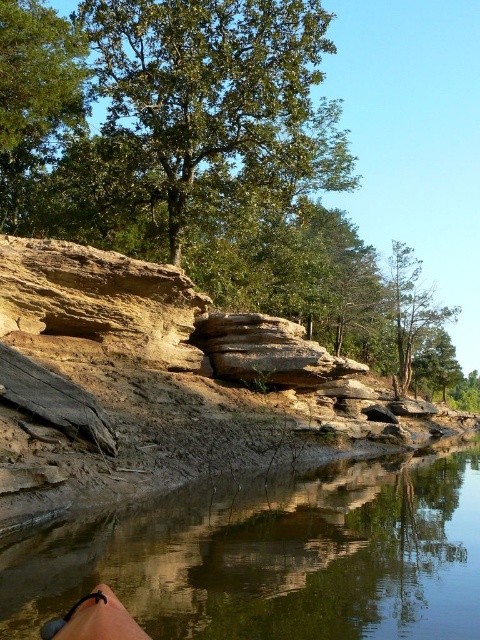
Question: Is green leafy tree at upper center smaller than green textured tree at right?

Choices:
 (A) no
 (B) yes

Answer: (B)

Question: Estimate the real-world distances between objects in this image. Which object is closer to the green leafy tree at upper center?

Choices:
 (A) brown dirt river at lower center
 (B) green leafy tree at upper left

Answer: (B)

Question: Does brown dirt river at lower center appear over green leafy tree at upper center?

Choices:
 (A) no
 (B) yes

Answer: (A)

Question: Which of the following is the closest to the observer?

Choices:
 (A) green leafy tree at upper center
 (B) green textured tree at right

Answer: (A)

Question: Is green leafy tree at upper center to the left of green textured tree at right from the viewer's perspective?

Choices:
 (A) no
 (B) yes

Answer: (B)

Question: Among these objects, which one is nearest to the camera?

Choices:
 (A) green textured tree at right
 (B) green leafy tree at upper center
 (C) brown dirt river at lower center

Answer: (C)